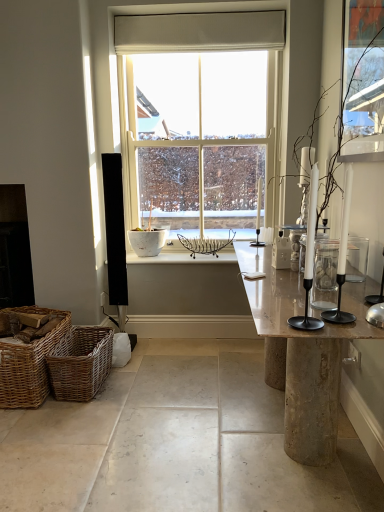
I want to click on free space in front of woven brown picnic basket at lower left, arranged as the 1th picnic basket when viewed from the right, so click(70, 419).